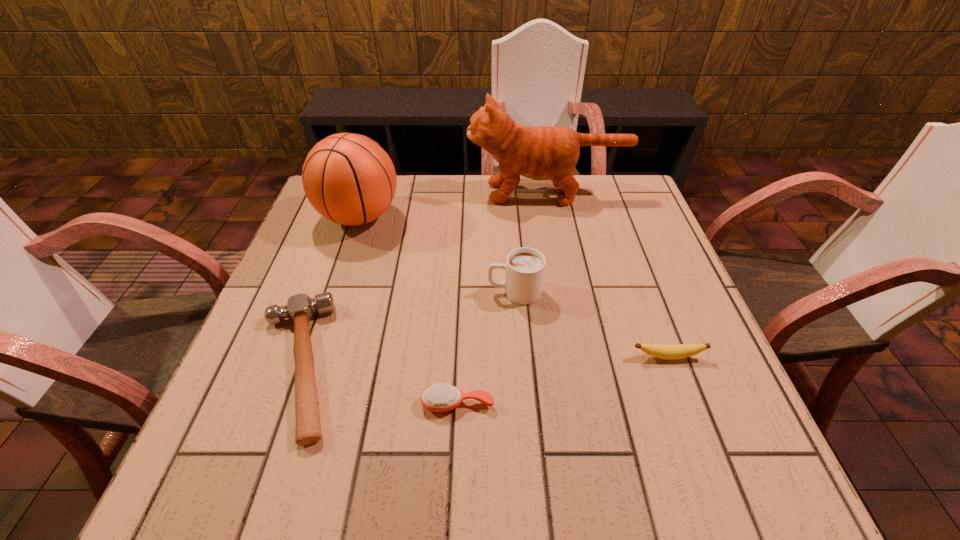
Where is `hammer that is at the left edge`? hammer that is at the left edge is located at coordinates (300, 308).

The height and width of the screenshot is (540, 960). I want to click on cat at the right edge, so click(540, 153).

Where is `banana present at the right edge`? The height and width of the screenshot is (540, 960). banana present at the right edge is located at coordinates (670, 352).

At what (x,y) coordinates should I click in order to perform the action: click on object that is at the far left corner. Please return your answer as a coordinate pair (x, y). Looking at the image, I should click on [348, 178].

Locate an element on the screen. The height and width of the screenshot is (540, 960). object that is at the near left corner is located at coordinates pyautogui.click(x=300, y=308).

This screenshot has width=960, height=540. Identify the location of object that is positioned at the far right corner. tap(540, 153).

You are a GUI agent. You are given a task and a screenshot of the screen. Output one action in this format:
    pyautogui.click(x=<x>, y=<y>)
    Task: Click on the vacant space at the far edge of the desktop
    This screenshot has width=960, height=540.
    Given the screenshot: What is the action you would take?
    pyautogui.click(x=406, y=195)

I want to click on vacant space at the left edge of the desktop, so click(x=310, y=234).

The image size is (960, 540). I want to click on free space at the right edge of the desktop, so click(621, 260).

This screenshot has height=540, width=960. In order to click on vacant area between the cat and the basketball in this screenshot , I will do `click(453, 205)`.